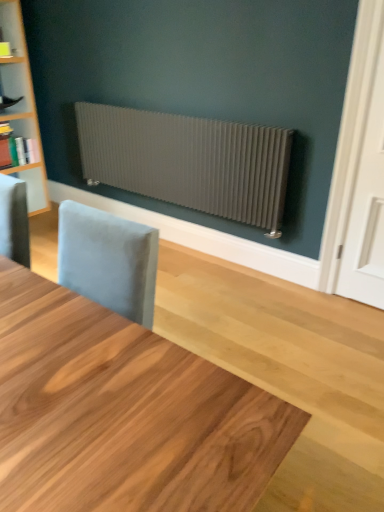
Question: From the image's perspective, would you say light wood table at center is shown under matte white bookshelf at left?

Choices:
 (A) no
 (B) yes

Answer: (B)

Question: From a real-world perspective, is light wood table at center beneath matte white bookshelf at left?

Choices:
 (A) yes
 (B) no

Answer: (A)

Question: Is light wood table at center closer to camera compared to matte white bookshelf at left?

Choices:
 (A) no
 (B) yes

Answer: (B)

Question: Can you confirm if light wood table at center is positioned to the right of matte white bookshelf at left?

Choices:
 (A) no
 (B) yes

Answer: (B)

Question: Is light wood table at center taller than matte white bookshelf at left?

Choices:
 (A) yes
 (B) no

Answer: (B)

Question: Is light wood table at center bigger or smaller than matte white bookshelf at left?

Choices:
 (A) big
 (B) small

Answer: (A)

Question: From their relative heights in the image, would you say light wood table at center is taller or shorter than matte white bookshelf at left?

Choices:
 (A) tall
 (B) short

Answer: (B)

Question: Does point (69, 371) appear closer or farther from the camera than point (36, 161)?

Choices:
 (A) closer
 (B) farther

Answer: (A)

Question: Looking at their shapes, would you say light wood table at center is wider or thinner than matte white bookshelf at left?

Choices:
 (A) wide
 (B) thin

Answer: (A)

Question: Is matte white bookshelf at left wider or thinner than satin silver radiator at upper center?

Choices:
 (A) wide
 (B) thin

Answer: (A)

Question: Is matte white bookshelf at left in front of or behind satin silver radiator at upper center in the image?

Choices:
 (A) behind
 (B) front

Answer: (A)

Question: Does point (36, 163) appear closer or farther from the camera than point (233, 144)?

Choices:
 (A) farther
 (B) closer

Answer: (A)

Question: In terms of size, does matte white bookshelf at left appear bigger or smaller than satin silver radiator at upper center?

Choices:
 (A) small
 (B) big

Answer: (A)

Question: Relative to light wood table at center, is matte white bookshelf at left in front or behind?

Choices:
 (A) front
 (B) behind

Answer: (B)

Question: In terms of size, does matte white bookshelf at left appear bigger or smaller than light wood table at center?

Choices:
 (A) big
 (B) small

Answer: (B)